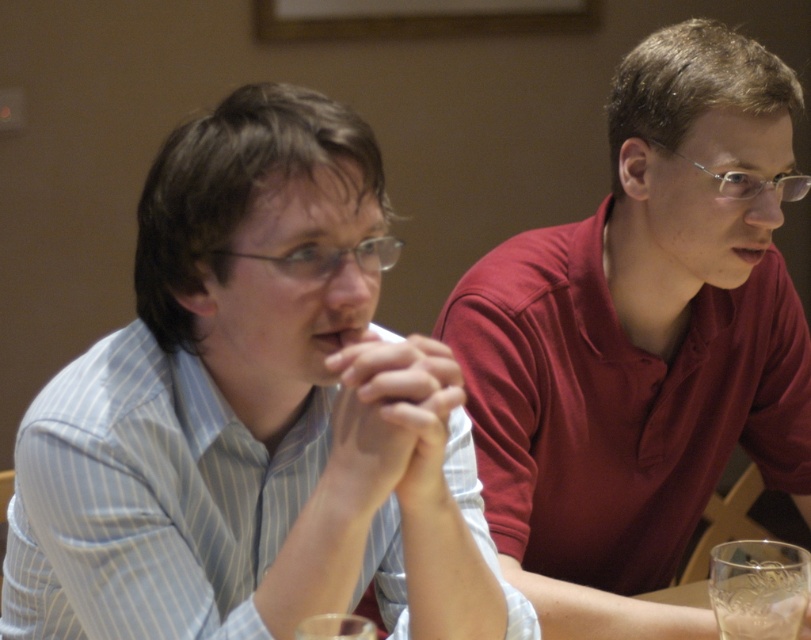
Who is higher up, matte red shirt at center or transparent glass at lower right?

matte red shirt at center

Is point (606, 228) farther from viewer compared to point (762, 547)?

That is True.

Find the location of a particular element. This screenshot has height=640, width=811. matte red shirt at center is located at coordinates (642, 340).